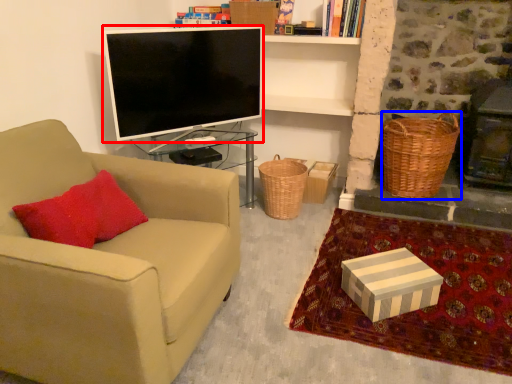
Question: Which point is closer to the camera, television (highlighted by a red box) or picnic basket (highlighted by a blue box)?

Choices:
 (A) television
 (B) picnic basket

Answer: (A)